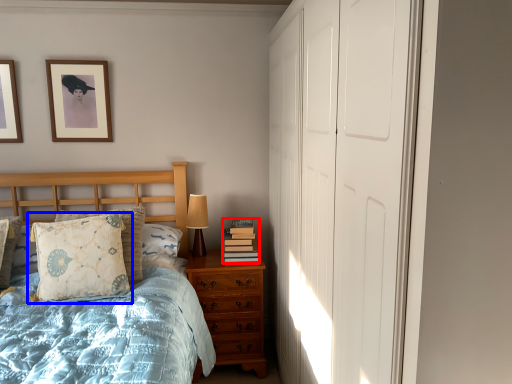
Question: Which of the following is the farthest to the observer, book (highlighted by a red box) or pillow (highlighted by a blue box)?

Choices:
 (A) book
 (B) pillow

Answer: (A)